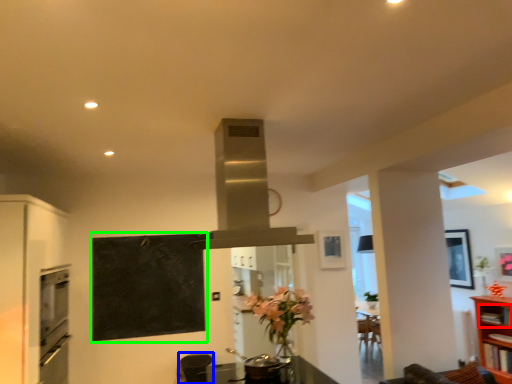
Question: Which object is the farthest from shelf (highlighted by a red box)? Choose among these: appliance (highlighted by a blue box) or bulletin board (highlighted by a green box).

Choices:
 (A) appliance
 (B) bulletin board

Answer: (B)